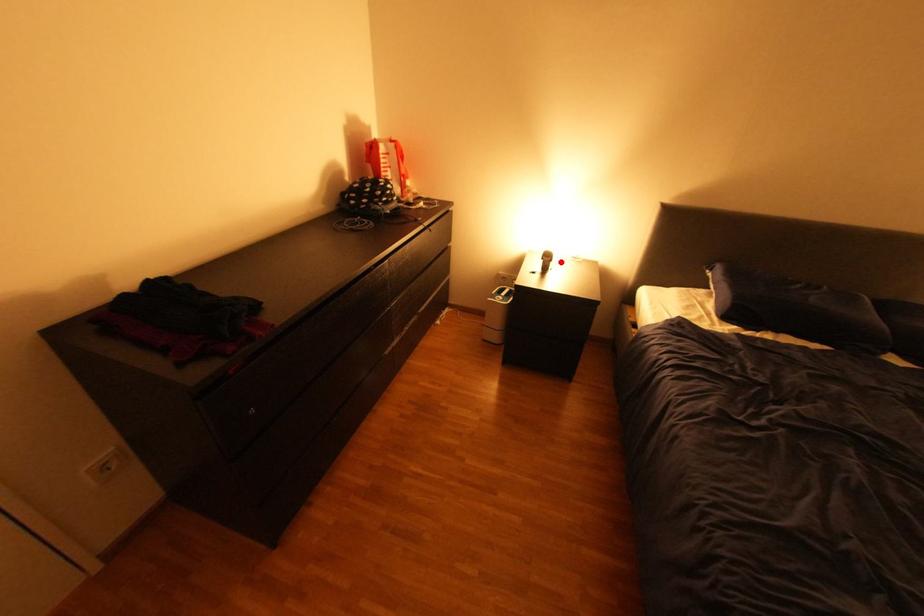
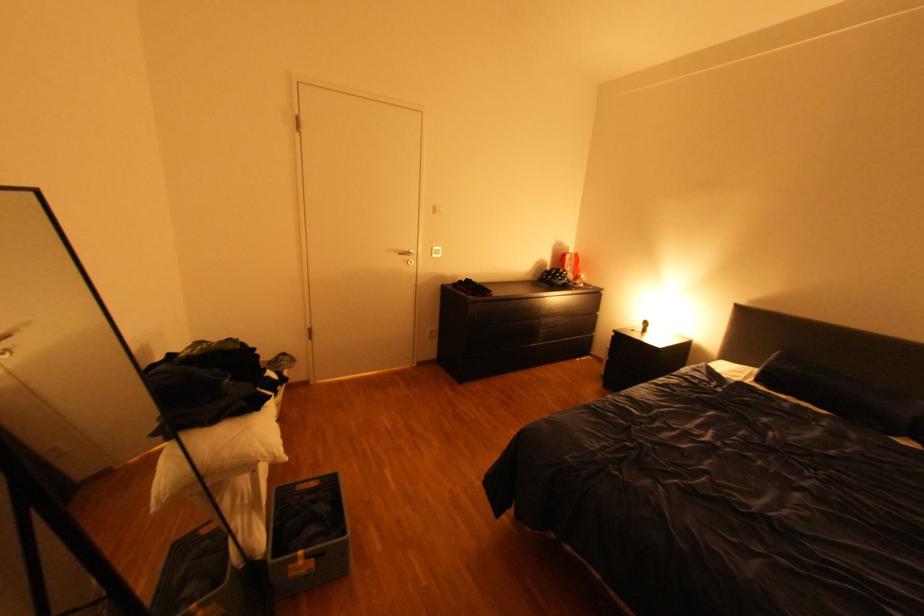
Question: I am providing you with two images of the same scene from different viewpoints. A red point is marked on the first image. At the location where the point appears in image 1, is it still visible in image 2?

Choices:
 (A) Yes
 (B) No

Answer: (A)